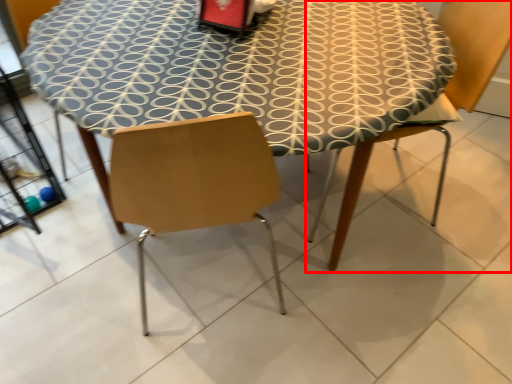
Question: Where is chair (annotated by the red box) located in relation to table in the image?

Choices:
 (A) left
 (B) right

Answer: (B)